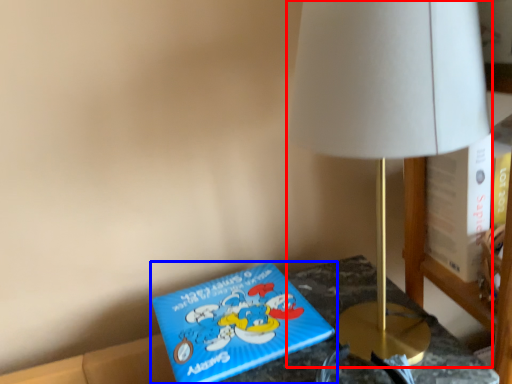
Question: Which point is closer to the camera, lamp (highlighted by a red box) or book (highlighted by a blue box)?

Choices:
 (A) lamp
 (B) book

Answer: (A)